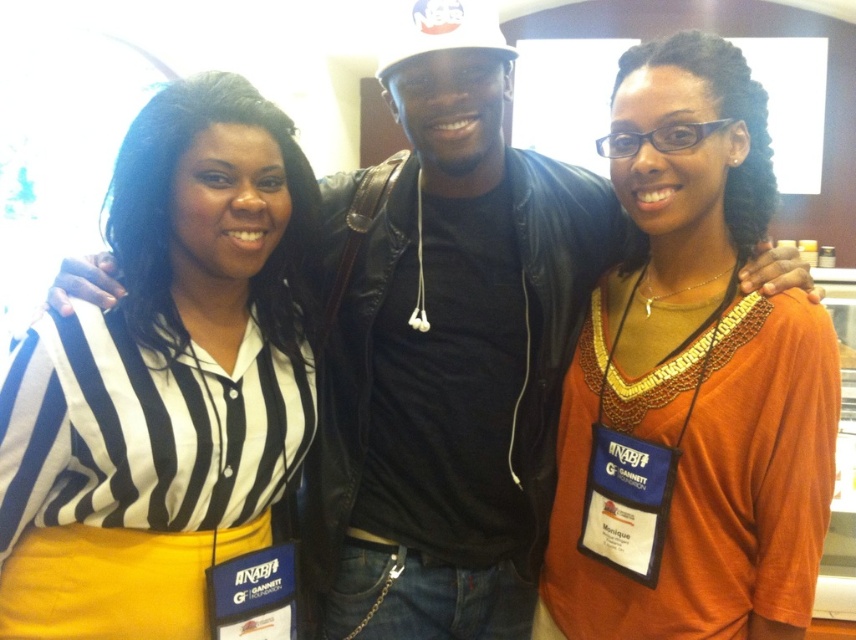
Is point (134, 225) more distant than point (562, 522)?

No.

How distant is black striped shirt at left from orange fabric shirt at center?

The distance of black striped shirt at left from orange fabric shirt at center is 58.29 centimeters.

This screenshot has height=640, width=856. Identify the location of black striped shirt at left. (168, 388).

The width and height of the screenshot is (856, 640). I want to click on black striped shirt at left, so click(168, 388).